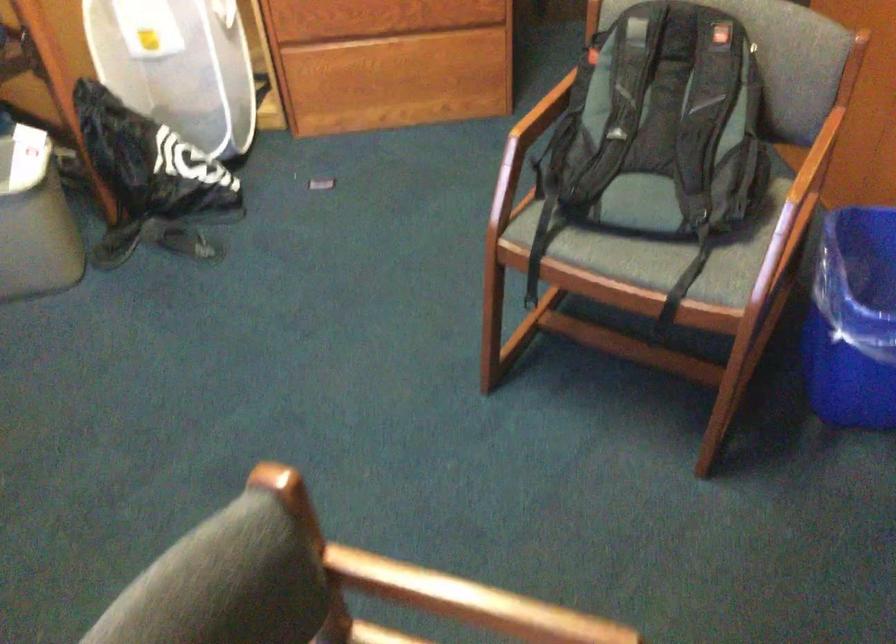
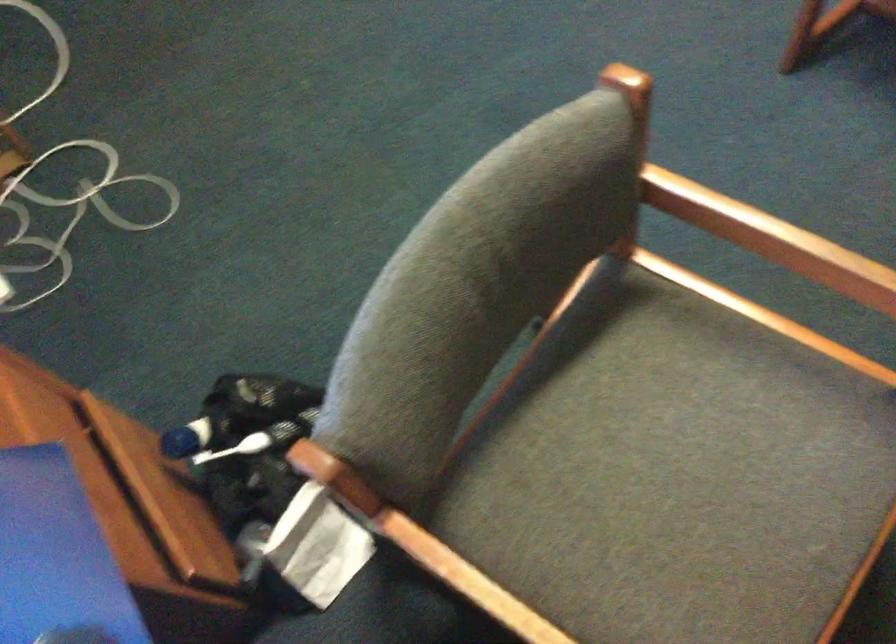
Which direction would the cameraman need to move to produce the second image?

The cameraman walked toward left, backward.